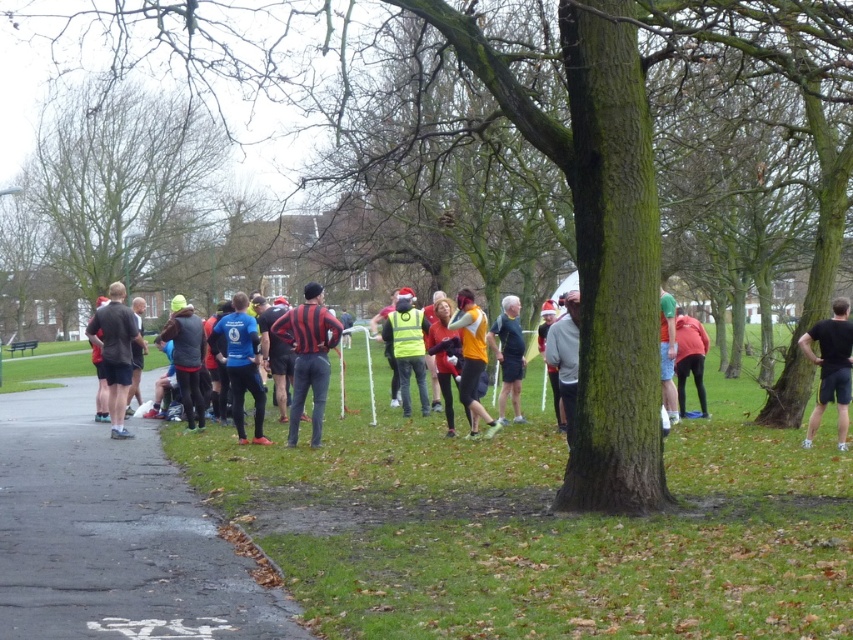
Question: Among these objects, which one is farthest from the camera?

Choices:
 (A) green rough bark tree at upper left
 (B) matte black jacket at center
 (C) orange fabric jacket at center
 (D) black matte shirt at right

Answer: (A)

Question: From the image, what is the correct spatial relationship of blue fabric shirt at center in relation to green fabric jacket at right?

Choices:
 (A) below
 (B) above

Answer: (A)

Question: Can you confirm if green rough bark tree at upper left is smaller than green fabric jacket at right?

Choices:
 (A) no
 (B) yes

Answer: (A)

Question: Can you confirm if blue fabric shirt at center is positioned to the left of matte blue shirt at center?

Choices:
 (A) no
 (B) yes

Answer: (B)

Question: Which object is the closest to the dark gray fabric jacket at left?

Choices:
 (A) high visibility yellow vest at center
 (B) matte black jacket at center
 (C) black matte shirt at right
 (D) dark gray asphalt at lower left

Answer: (B)

Question: Which point is closer to the camera?

Choices:
 (A) (703, 346)
 (B) (418, 365)
 (C) (257, 596)

Answer: (C)